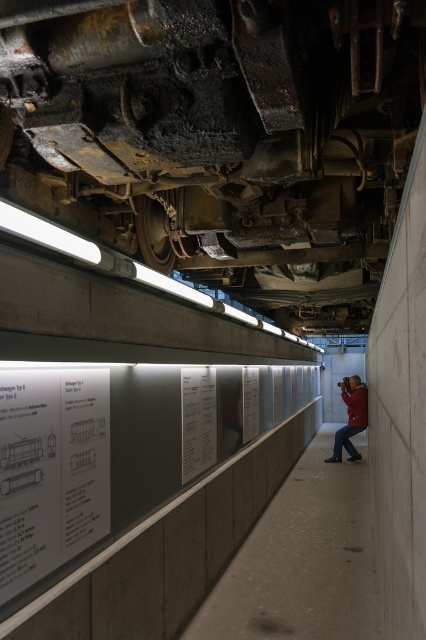
Between point (317, 198) and point (6, 592), which one is positioned in front?

Positioned in front is point (6, 592).

Where is `rusty metal train car at center`? rusty metal train car at center is located at coordinates (230, 112).

Who is lower down, rusty metal train car at center or red leather jacket at center?

red leather jacket at center is lower down.

Does rusty metal train car at center have a lesser width compared to red leather jacket at center?

In fact, rusty metal train car at center might be wider than red leather jacket at center.

Does point (365, 20) come behind point (356, 417)?

No, (365, 20) is in front of (356, 417).

Where is `rusty metal train car at center`? Image resolution: width=426 pixels, height=640 pixels. rusty metal train car at center is located at coordinates (230, 112).

Is white paper poster at lower left positioned before white paper poster at center?

Yes, white paper poster at lower left is in front of white paper poster at center.

Is point (2, 572) less distant than point (187, 413)?

Yes.

Image resolution: width=426 pixels, height=640 pixels. What are the coordinates of `white paper poster at lower left` in the screenshot? It's located at (51, 470).